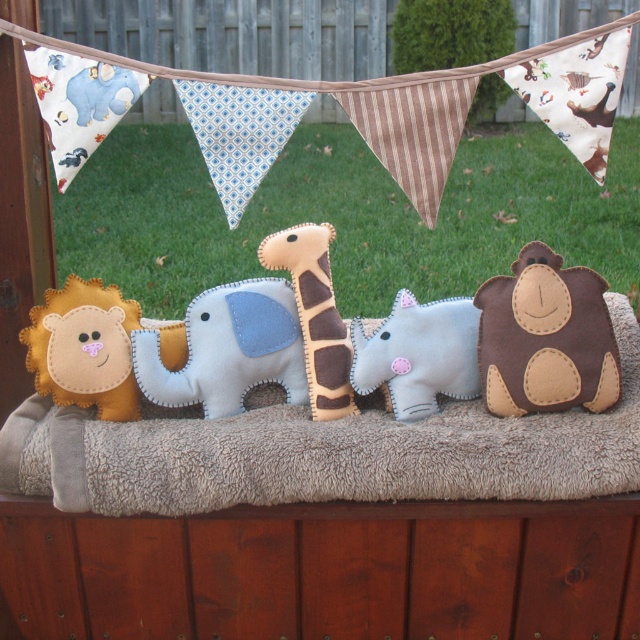
Question: Estimate the real-world distances between objects in this image. Which object is farther from the felt elephant at center?

Choices:
 (A) white felt baby elephant at center
 (B) soft felt giraffe at center
 (C) brown felt monkey at center

Answer: (C)

Question: Which point is farther to the camera?

Choices:
 (A) soft felt giraffe at center
 (B) brown felt monkey at center

Answer: (A)

Question: Based on their relative distances, which object is farther from the felt elephant at center?

Choices:
 (A) white felt baby elephant at center
 (B) brown felt monkey at center
 (C) soft felt giraffe at center

Answer: (B)

Question: Can you confirm if brown felt monkey at center is positioned above soft felt giraffe at center?

Choices:
 (A) yes
 (B) no

Answer: (B)

Question: Does felt elephant at center lie behind white felt baby elephant at center?

Choices:
 (A) yes
 (B) no

Answer: (A)

Question: Does felt elephant at center appear on the right side of white felt baby elephant at center?

Choices:
 (A) yes
 (B) no

Answer: (B)